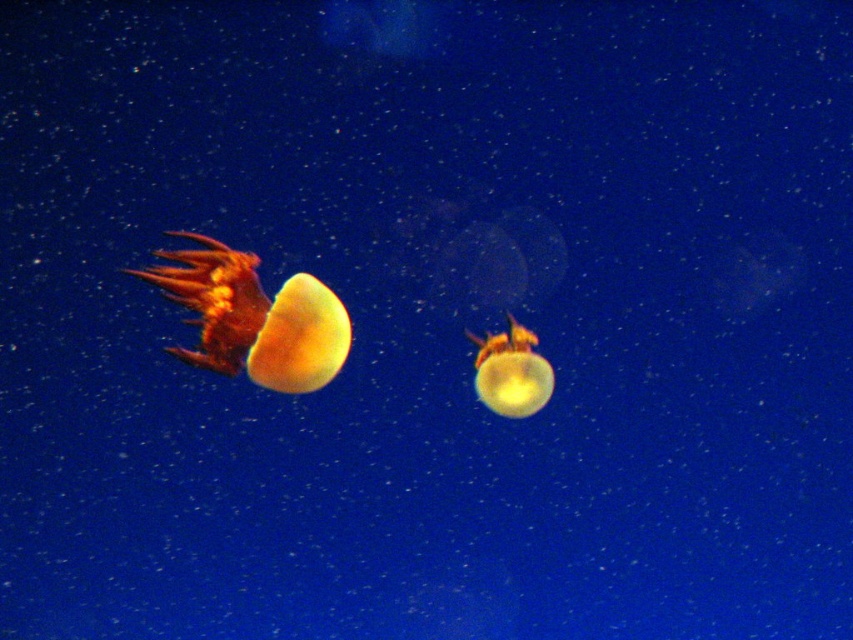
Does translucent orange jellyfish at left have a greater width compared to translucent yellow jellyfish at center?

Correct, the width of translucent orange jellyfish at left exceeds that of translucent yellow jellyfish at center.

Which is below, translucent orange jellyfish at left or translucent yellow jellyfish at center?

translucent yellow jellyfish at center

You are a GUI agent. You are given a task and a screenshot of the screen. Output one action in this format:
    pyautogui.click(x=<x>, y=<y>)
    Task: Click on the translucent orange jellyfish at left
    This screenshot has height=640, width=853.
    Given the screenshot: What is the action you would take?
    253,317

Find the location of a particular element. The image size is (853, 640). translucent orange jellyfish at left is located at coordinates (253, 317).